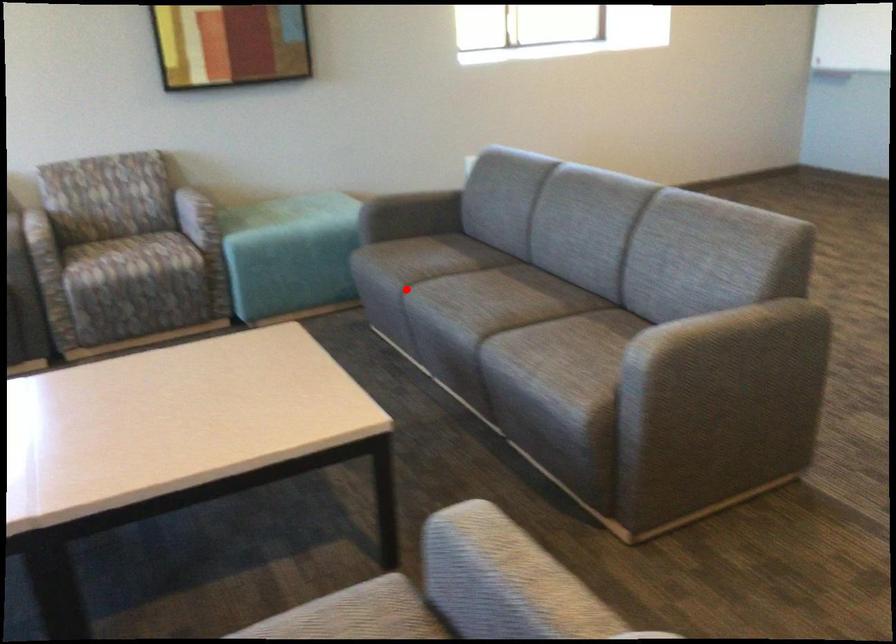
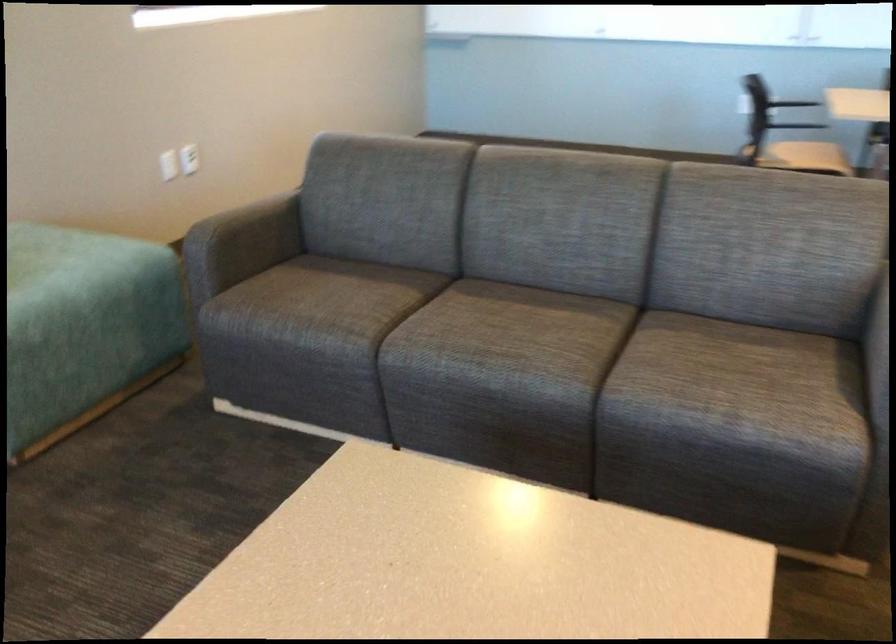
In the second image, find the point that corresponds to the highlighted location in the first image.

(358, 343)